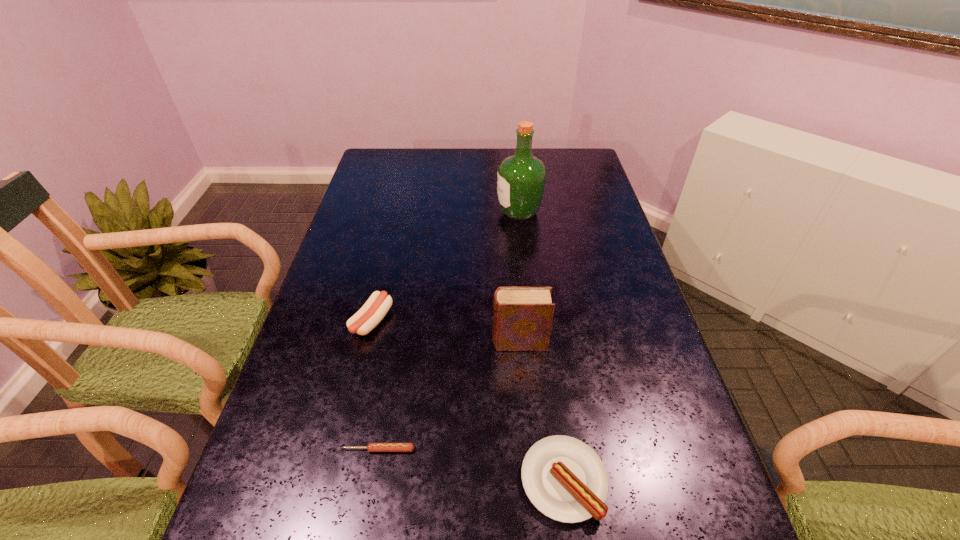
This screenshot has width=960, height=540. In order to click on free space at the right edge of the desktop in this screenshot , I will do `click(628, 309)`.

The image size is (960, 540). In the image, there is a desktop. What are the coordinates of `vacant region at the far right corner` in the screenshot? It's located at (552, 166).

Find the location of a particular element. Image resolution: width=960 pixels, height=540 pixels. free space that is in between the second tallest object and the liquor is located at coordinates (519, 277).

Identify the location of free space between the third tallest object and the second tallest sausage. The image size is (960, 540). (468, 401).

Where is `empty location between the fourth shortest object and the shortest object`? The height and width of the screenshot is (540, 960). empty location between the fourth shortest object and the shortest object is located at coordinates (449, 396).

Locate an element on the screen. The height and width of the screenshot is (540, 960). vacant space that is in between the tallest object and the shortest sausage is located at coordinates (449, 330).

Find the location of a particular element. Image resolution: width=960 pixels, height=540 pixels. free space that is in between the third tallest object and the shortest object is located at coordinates tap(375, 386).

This screenshot has height=540, width=960. I want to click on vacant space that's between the farthest object and the tallest sausage, so click(x=445, y=267).

Find the location of `free spot between the fourth shortest object and the farthest object`. free spot between the fourth shortest object and the farthest object is located at coordinates (519, 277).

This screenshot has height=540, width=960. Find the location of `vacant area that lies between the shortest object and the farthest object`. vacant area that lies between the shortest object and the farthest object is located at coordinates (449, 330).